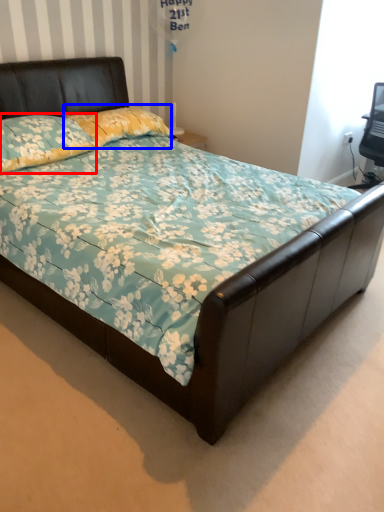
Question: Which point is further to the camera, pillow (highlighted by a red box) or pillow (highlighted by a blue box)?

Choices:
 (A) pillow
 (B) pillow

Answer: (B)